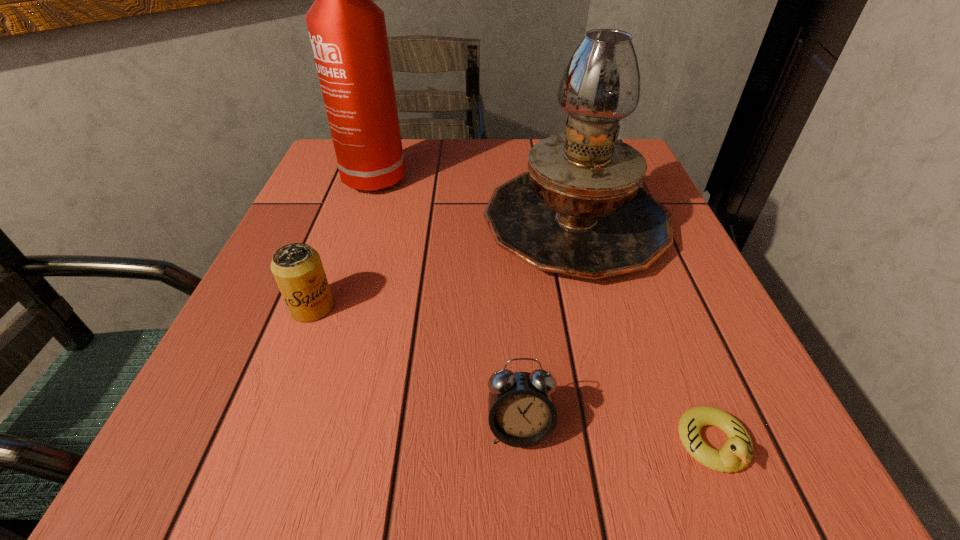
Locate an element on the screen. vacant space at the near edge is located at coordinates (x=474, y=444).

In the image, there is a desktop. At what (x,y) coordinates should I click in order to perform the action: click on blank space at the left edge. Please return your answer as a coordinate pair (x, y). Looking at the image, I should click on (219, 399).

Where is `vacant space at the right edge of the desktop`? This screenshot has width=960, height=540. vacant space at the right edge of the desktop is located at coordinates (679, 244).

Image resolution: width=960 pixels, height=540 pixels. In the image, there is a desktop. Find the location of `vacant space at the near right corner`. vacant space at the near right corner is located at coordinates 664,429.

This screenshot has width=960, height=540. I want to click on empty location between the tallest object and the duckling, so click(x=544, y=309).

What are the coordinates of `free spot between the alarm clock and the tallest object` in the screenshot? It's located at pos(447,301).

Find the location of `empty location between the alarm clock and the third farthest object`. empty location between the alarm clock and the third farthest object is located at coordinates (416, 368).

The height and width of the screenshot is (540, 960). What are the coordinates of `empty location between the tallest object and the alarm clock` in the screenshot? It's located at (447, 301).

You are a GUI agent. You are given a task and a screenshot of the screen. Output one action in this format:
    pyautogui.click(x=<x>, y=<y>)
    Task: Click on the free space between the duckling and the fire extinguisher
    
    Given the screenshot: What is the action you would take?
    pyautogui.click(x=544, y=309)

Find the location of a particular element. The image size is (960, 540). free point between the alarm clock and the beer can is located at coordinates (416, 368).